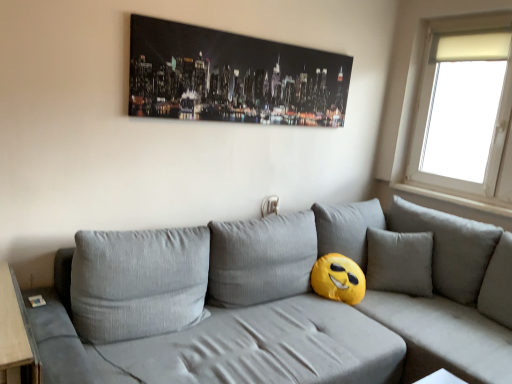
What do you see at coordinates (439, 83) in the screenshot? I see `white frosted glass window at upper right` at bounding box center [439, 83].

This screenshot has width=512, height=384. Describe the element at coordinates (232, 77) in the screenshot. I see `black glossy canvas at upper center` at that location.

In order to click on white frosted glass window at upper right in this screenshot , I will do `click(439, 83)`.

Consider the image. What's the angular difference between black glossy canvas at upper center and textured gray couch at center's facing directions?

black glossy canvas at upper center and textured gray couch at center are facing 1.15 degrees away from each other.

Is black glossy canvas at upper center next to textured gray couch at center?

There is a gap between black glossy canvas at upper center and textured gray couch at center.

Is black glossy canvas at upper center spatially inside textured gray couch at center, or outside of it?

black glossy canvas at upper center cannot be found inside textured gray couch at center.

Can you confirm if black glossy canvas at upper center is smaller than textured gray couch at center?

Yes, black glossy canvas at upper center is smaller than textured gray couch at center.

Could you tell me if white frosted glass window at upper right is turned towards textured gray couch at center?

Yes.

Which object is thinner, white frosted glass window at upper right or textured gray couch at center?

Thinner between the two is white frosted glass window at upper right.

Considering the relative sizes of white frosted glass window at upper right and textured gray couch at center in the image provided, is white frosted glass window at upper right bigger than textured gray couch at center?

Incorrect, white frosted glass window at upper right is not larger than textured gray couch at center.

Is the depth of white frosted glass window at upper right greater than that of textured gray couch at center?

Yes.

Does white frosted glass window at upper right lie behind black glossy canvas at upper center?

Yes, white frosted glass window at upper right is behind black glossy canvas at upper center.

From a real-world perspective, is white frosted glass window at upper right over black glossy canvas at upper center?

No, from a real-world perspective, white frosted glass window at upper right is not on top of black glossy canvas at upper center.

Is white frosted glass window at upper right oriented away from black glossy canvas at upper center?

That's not correct — white frosted glass window at upper right is not looking away from black glossy canvas at upper center.

Which of these two, white frosted glass window at upper right or black glossy canvas at upper center, is bigger?

white frosted glass window at upper right is bigger.

Based on the photo, is black glossy canvas at upper center looking in the opposite direction of white frosted glass window at upper right?

No, white frosted glass window at upper right is not at the back of black glossy canvas at upper center.

What's the angular difference between black glossy canvas at upper center and white frosted glass window at upper right's facing directions?

They differ by 90 degrees in their facing directions.

From a real-world perspective, is black glossy canvas at upper center on white frosted glass window at upper right?

Indeed, from a real-world perspective, black glossy canvas at upper center stands above white frosted glass window at upper right.

Is the surface of black glossy canvas at upper center in direct contact with white frosted glass window at upper right?

No.

Based on the photo, considering the sizes of objects textured gray couch at center and white frosted glass window at upper right in the image provided, who is smaller, textured gray couch at center or white frosted glass window at upper right?

white frosted glass window at upper right.

Can you confirm if textured gray couch at center is thinner than white frosted glass window at upper right?

In fact, textured gray couch at center might be wider than white frosted glass window at upper right.

Consider the image. Which is behind, textured gray couch at center or white frosted glass window at upper right?

Positioned behind is white frosted glass window at upper right.

I want to click on studio couch located underneath the white frosted glass window at upper right (from a real-world perspective), so click(x=320, y=309).

Is black glossy canvas at upper center located within textured gray couch at center?

No, black glossy canvas at upper center is located outside of textured gray couch at center.

Looking at this image, which object is positioned more to the left, textured gray couch at center or black glossy canvas at upper center?

From the viewer's perspective, black glossy canvas at upper center appears more on the left side.

Would you say textured gray couch at center is a long distance from black glossy canvas at upper center?

No, there isn't a large distance between textured gray couch at center and black glossy canvas at upper center.

Where is `picture frame behind the textured gray couch at center`? This screenshot has width=512, height=384. picture frame behind the textured gray couch at center is located at coordinates (232, 77).

At what (x,y) coordinates should I click in order to perform the action: click on studio couch lying in front of the white frosted glass window at upper right. Please return your answer as a coordinate pair (x, y). The image size is (512, 384). Looking at the image, I should click on tap(320, 309).

Considering their positions, is textured gray couch at center positioned closer to white frosted glass window at upper right than black glossy canvas at upper center?

Based on the image, textured gray couch at center appears to be nearer to white frosted glass window at upper right.

When comparing their distances from textured gray couch at center, does black glossy canvas at upper center or white frosted glass window at upper right seem further?

The object further to textured gray couch at center is white frosted glass window at upper right.

Looking at this image, considering their positions, is white frosted glass window at upper right positioned closer to textured gray couch at center than black glossy canvas at upper center?

black glossy canvas at upper center is positioned closer to the anchor textured gray couch at center.

When comparing their distances from black glossy canvas at upper center, does white frosted glass window at upper right or textured gray couch at center seem further?

white frosted glass window at upper right lies further to black glossy canvas at upper center than the other object.

Which object lies further to the anchor point black glossy canvas at upper center, textured gray couch at center or white frosted glass window at upper right?

white frosted glass window at upper right is positioned further to the anchor black glossy canvas at upper center.

Looking at the image, which one is located closer to white frosted glass window at upper right, black glossy canvas at upper center or textured gray couch at center?

textured gray couch at center.

The height and width of the screenshot is (384, 512). I want to click on picture frame between textured gray couch at center and white frosted glass window at upper right in the front-back direction, so click(x=232, y=77).